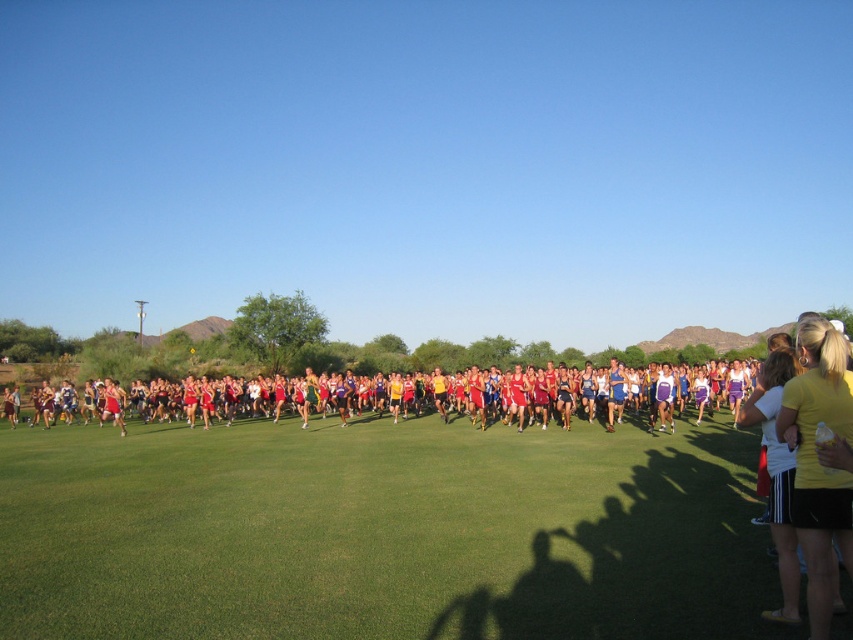
Is green grass at center taller than matte red shorts at center?

In fact, green grass at center may be shorter than matte red shorts at center.

Describe the element at coordinates (380, 531) in the screenshot. This screenshot has height=640, width=853. I see `green grass at center` at that location.

The image size is (853, 640). I want to click on green grass at center, so click(380, 531).

Which is below, yellow fabric at right or matte red shorts at center?

matte red shorts at center is below.

Is point (830, 332) positioned behind point (47, 369)?

That is False.

Find the location of a particular element. The image size is (853, 640). yellow fabric at right is located at coordinates (817, 460).

Does green grass at center appear over yellow fabric at right?

No.

Does green grass at center appear on the right side of yellow fabric at right?

In fact, green grass at center is to the left of yellow fabric at right.

Between point (590, 596) and point (831, 490), which one is positioned behind?

The point (590, 596) is behind.

Identify the location of green grass at center. (380, 531).